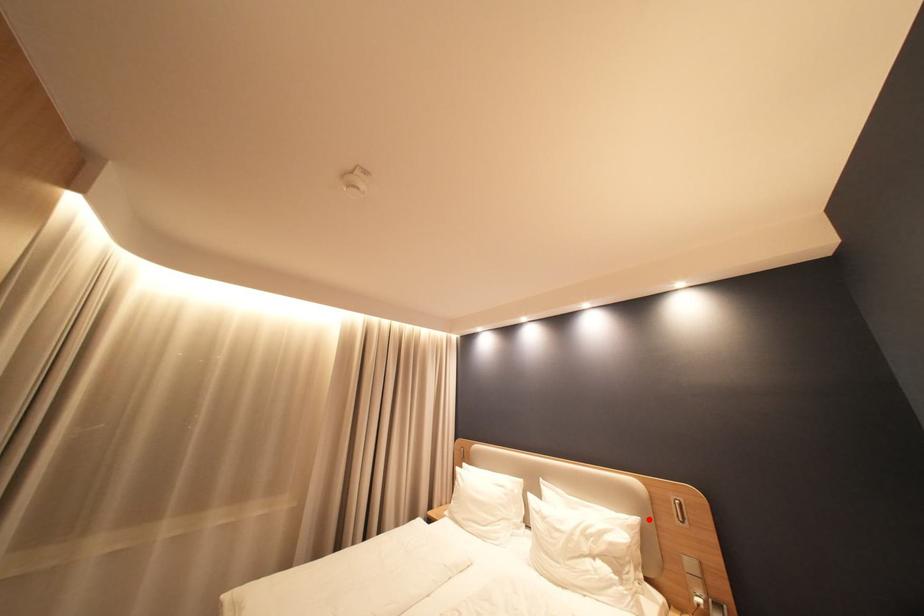
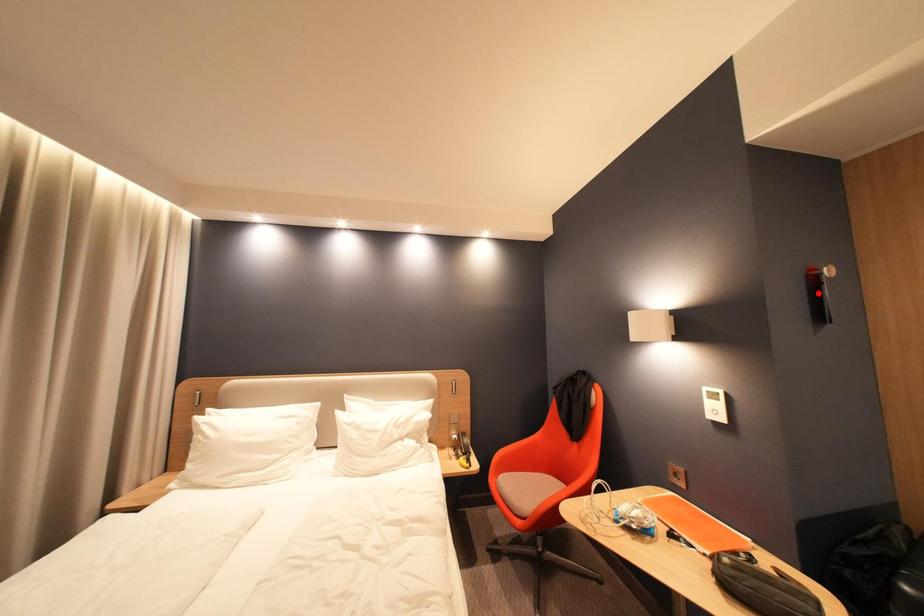
I am providing you with two images of the same scene from different viewpoints. A red point is marked on the first image and another point is marked on the second image. Does the point marked in image1 correspond to the same location as the one in image2?

No